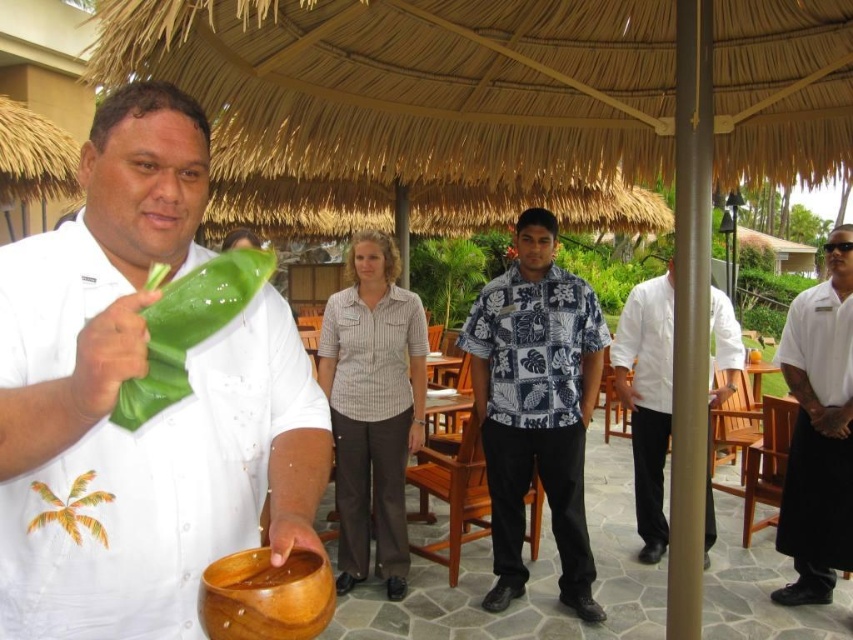
You are a guest at this tropical outdoor event and want to take a photo of the brown wooden bowl at lower center without the white matte shirt at center blocking it. How should you adjust your position?

Move your position so that you are not directly in front of the white matte shirt at center, which is currently blocking the view of the brown wooden bowl at lower center. Since the white matte shirt at center is in front of the brown wooden bowl at lower center, moving to the side or behind the shirt could allow you to capture the bowl without obstruction.

You are a guest at this tropical outdoor event and notice two shirts on a rack nearby. The shirts are labeled as the white shirt at center and the white glossy shirt at center. Which shirt is taller?

The white shirt at center is taller than the white glossy shirt at center.

Based on the scene description, which object is positioned higher between the white shirt at center and the white glossy shirt at center?

The white shirt at center is positioned higher than the white glossy shirt at center.